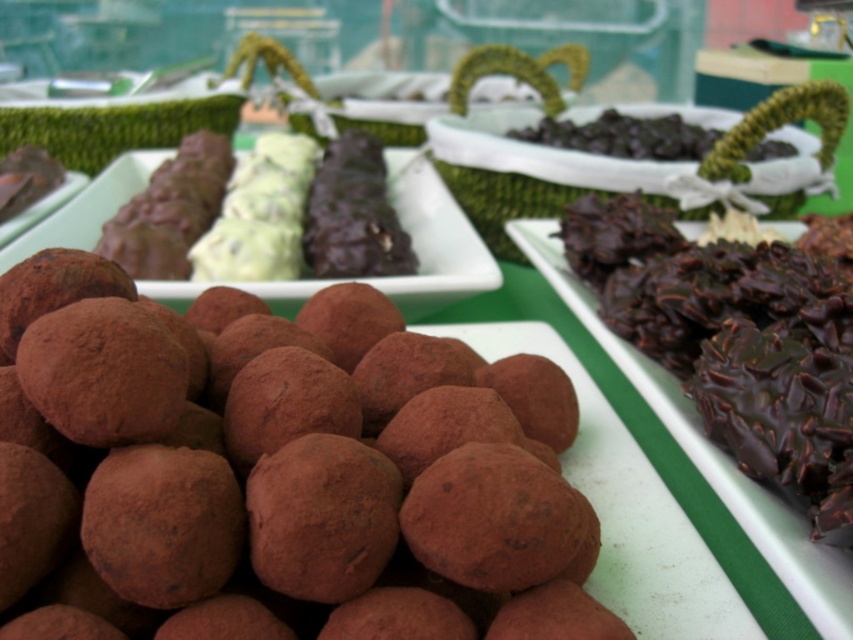
What do you see at coordinates (277, 472) in the screenshot? This screenshot has width=853, height=640. I see `brown matte truffles at lower left` at bounding box center [277, 472].

Which of these two, brown matte truffles at lower left or chocolate-coated nuts at right, stands shorter?

brown matte truffles at lower left is shorter.

Identify the location of brown matte truffles at lower left. Image resolution: width=853 pixels, height=640 pixels. (277, 472).